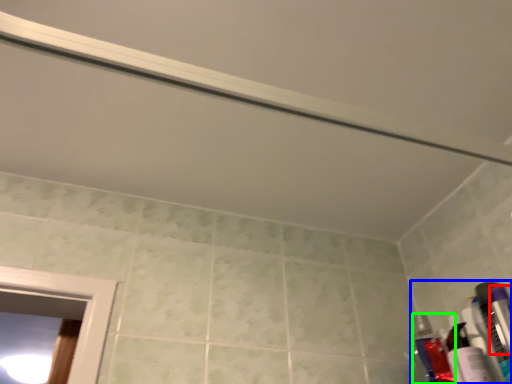
Question: Considering the real-world distances, which object is farthest from toiletry (highlighted by a red box)? toiletry (highlighted by a blue box) or toiletry (highlighted by a green box)?

Choices:
 (A) toiletry
 (B) toiletry

Answer: (B)